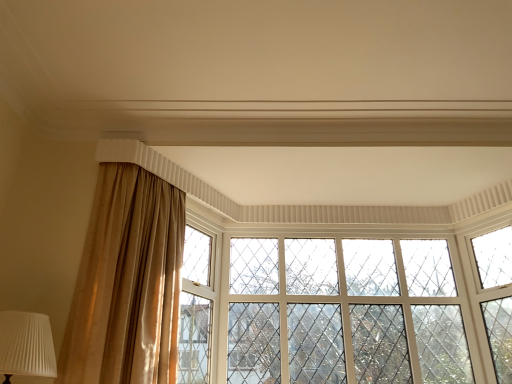
Question: Can white pleated fabric at lower left be found inside clear glass window at center?

Choices:
 (A) no
 (B) yes

Answer: (A)

Question: Is clear glass window at center closer to camera compared to white pleated fabric at lower left?

Choices:
 (A) no
 (B) yes

Answer: (A)

Question: Is clear glass window at center completely or partially outside of white pleated fabric at lower left?

Choices:
 (A) yes
 (B) no

Answer: (A)

Question: Is clear glass window at center taller than white pleated fabric at lower left?

Choices:
 (A) no
 (B) yes

Answer: (B)

Question: Is clear glass window at center directly adjacent to white pleated fabric at lower left?

Choices:
 (A) no
 (B) yes

Answer: (A)

Question: From a real-world perspective, is clear glass window at center physically located above or below satin beige curtain at left?

Choices:
 (A) below
 (B) above

Answer: (B)

Question: Is clear glass window at center taller or shorter than satin beige curtain at left?

Choices:
 (A) short
 (B) tall

Answer: (B)

Question: In terms of width, does clear glass window at center look wider or thinner when compared to satin beige curtain at left?

Choices:
 (A) wide
 (B) thin

Answer: (B)

Question: Is clear glass window at center inside the boundaries of satin beige curtain at left, or outside?

Choices:
 (A) inside
 (B) outside

Answer: (B)

Question: Is satin beige curtain at left taller or shorter than white pleated fabric at lower left?

Choices:
 (A) short
 (B) tall

Answer: (B)

Question: Which is correct: satin beige curtain at left is inside white pleated fabric at lower left, or outside of it?

Choices:
 (A) outside
 (B) inside

Answer: (A)

Question: Considering the positions of point (91, 354) and point (23, 314), is point (91, 354) closer or farther from the camera than point (23, 314)?

Choices:
 (A) farther
 (B) closer

Answer: (A)

Question: Based on their sizes in the image, would you say satin beige curtain at left is bigger or smaller than white pleated fabric at lower left?

Choices:
 (A) big
 (B) small

Answer: (A)

Question: Relative to white pleated fabric at lower left, is clear glass window at center in front or behind?

Choices:
 (A) front
 (B) behind

Answer: (B)

Question: Looking at the image, does clear glass window at center seem bigger or smaller compared to white pleated fabric at lower left?

Choices:
 (A) big
 (B) small

Answer: (A)